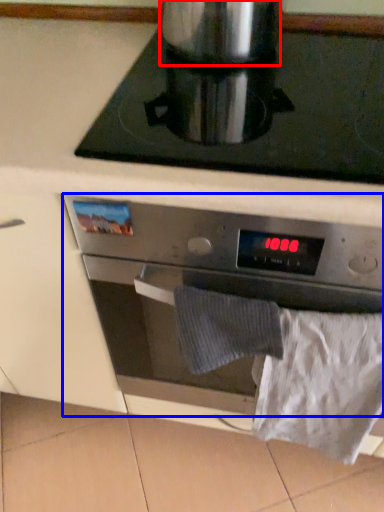
Question: Among these objects, which one is nearest to the camera, appliance (highlighted by a red box) or kitchen appliance (highlighted by a blue box)?

Choices:
 (A) appliance
 (B) kitchen appliance

Answer: (B)